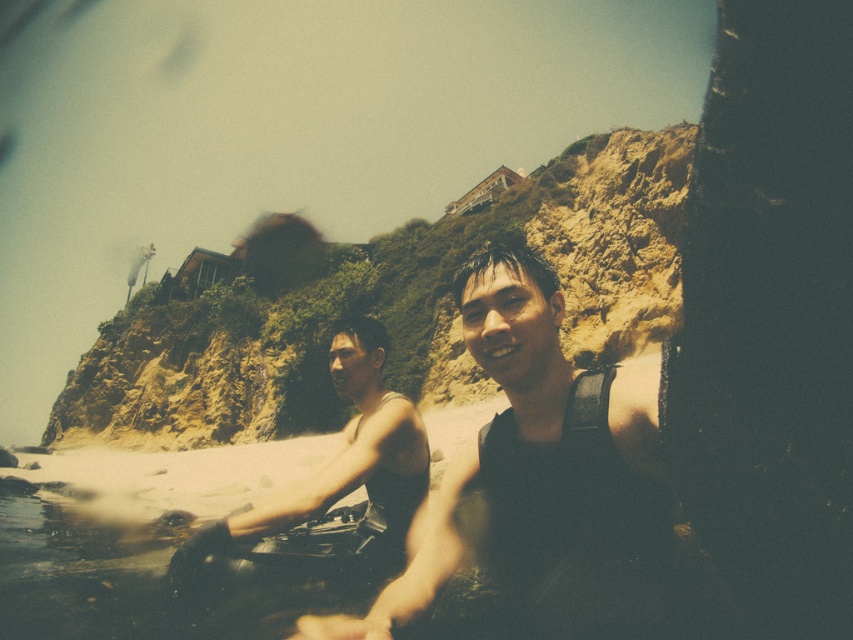
Is dark gray wetsuit at center positioned in front of matte black wetsuit at center?

Yes, it is.

Is dark gray wetsuit at center behind matte black wetsuit at center?

No, dark gray wetsuit at center is in front of matte black wetsuit at center.

Does point (495, 348) lie in front of point (337, 355)?

Yes, it is.

Find the location of a particular element. The width and height of the screenshot is (853, 640). dark gray wetsuit at center is located at coordinates (537, 465).